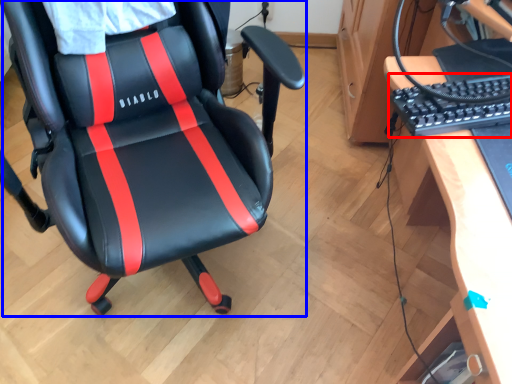
Question: Which point is further to the camera, computer keyboard (highlighted by a red box) or chair (highlighted by a blue box)?

Choices:
 (A) computer keyboard
 (B) chair

Answer: (A)